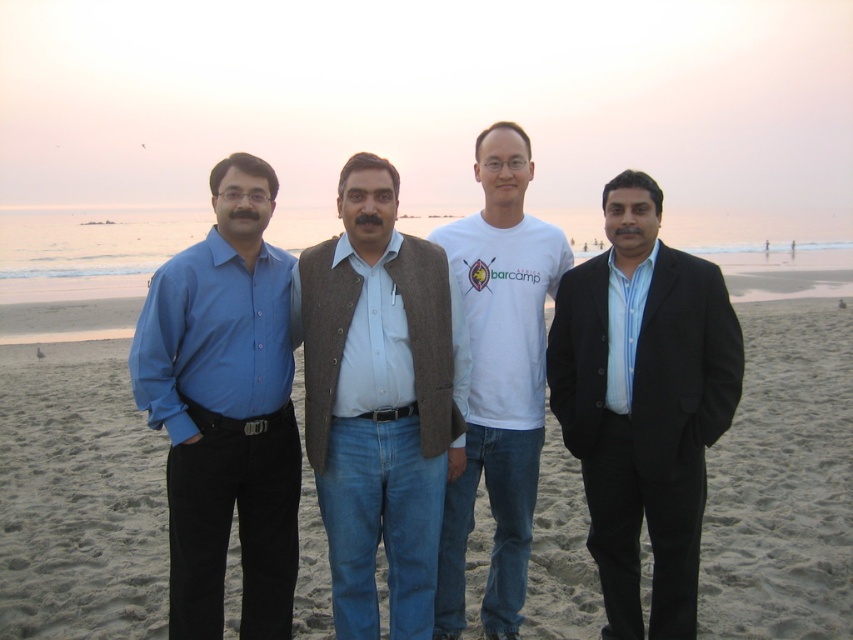
Question: Can you confirm if matte blue shirt at left is smaller than white cotton t-shirt at center?

Choices:
 (A) no
 (B) yes

Answer: (A)

Question: From the image, what is the correct spatial relationship of sandy beach at center in relation to black matte suit at center?

Choices:
 (A) above
 (B) below

Answer: (B)

Question: Can you confirm if sandy beach at center is bigger than matte blue shirt at left?

Choices:
 (A) no
 (B) yes

Answer: (B)

Question: Among these points, which one is farthest from the camera?

Choices:
 (A) (364, 216)
 (B) (148, 356)
 (C) (503, 173)
 (D) (122, 577)

Answer: (D)

Question: Which object is positioned farthest from the brown woolen vest at center?

Choices:
 (A) sandy beach at center
 (B) black matte suit at center
 (C) matte blue shirt at left
 (D) white cotton t-shirt at center

Answer: (A)

Question: Which point is closer to the camera?

Choices:
 (A) white cotton t-shirt at center
 (B) brown woolen vest at center
 (C) black matte suit at center
 (D) sandy beach at center

Answer: (C)